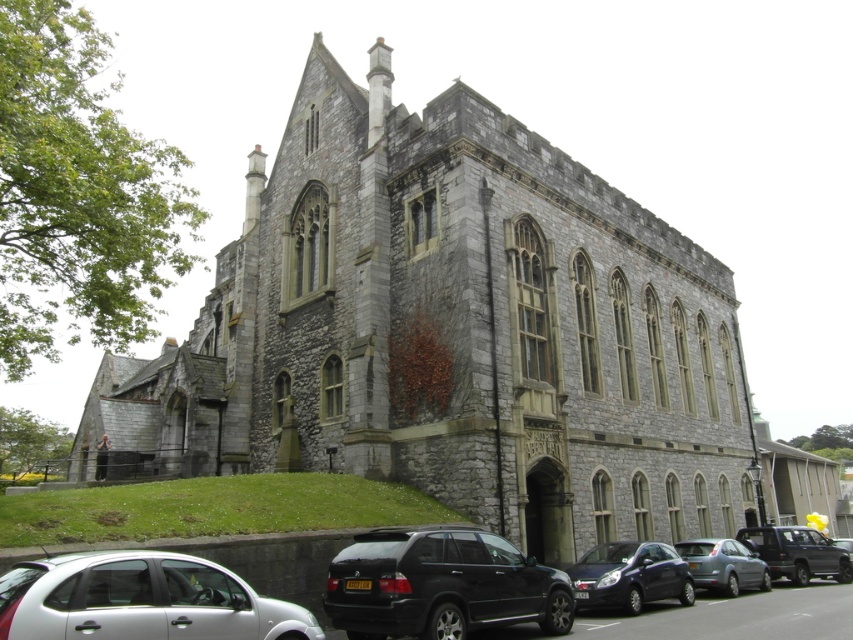
Question: Considering the real-world distances, which object is closest to the black matte suv at lower center?

Choices:
 (A) matte gray sedan at lower right
 (B) metallic gray suv at lower right
 (C) white matte hatchback at lower left

Answer: (C)

Question: Which is farther from the matte gray sedan at lower right?

Choices:
 (A) metallic gray suv at lower right
 (B) gray stone church at center

Answer: (B)

Question: Does dark blue metallic car at lower center lie behind metallic gray suv at lower right?

Choices:
 (A) yes
 (B) no

Answer: (B)

Question: Which is nearer to the white matte hatchback at lower left?

Choices:
 (A) matte gray sedan at lower right
 (B) metallic gray suv at lower right
 (C) dark blue metallic car at lower center

Answer: (C)

Question: Is white matte hatchback at lower left closer to the viewer compared to dark blue metallic car at lower center?

Choices:
 (A) no
 (B) yes

Answer: (B)

Question: Is gray stone church at center further to camera compared to white matte hatchback at lower left?

Choices:
 (A) no
 (B) yes

Answer: (B)